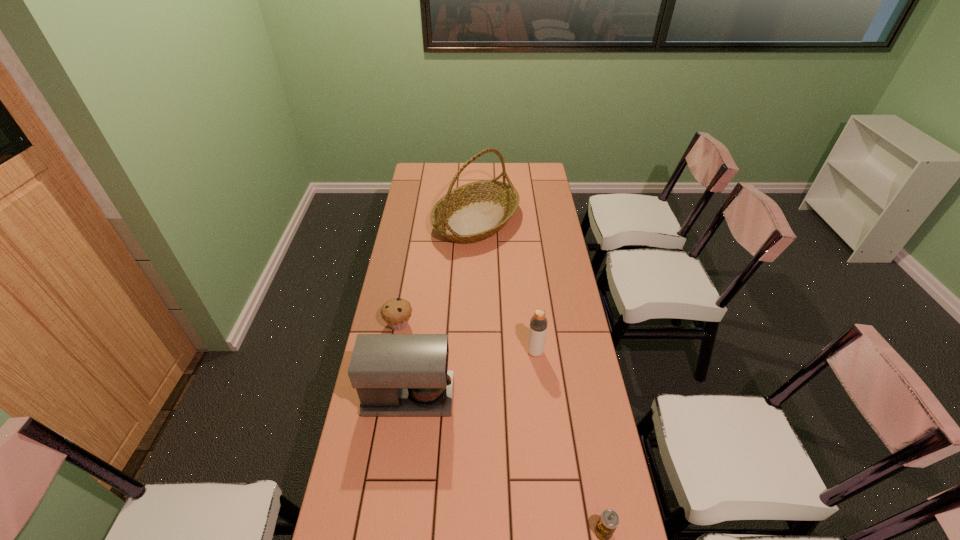
The height and width of the screenshot is (540, 960). What are the coordinates of `basket` in the screenshot? It's located at (475, 211).

In order to click on the farthest object in this screenshot , I will do `click(475, 211)`.

In order to click on the fourth farthest object in this screenshot , I will do `click(394, 374)`.

Image resolution: width=960 pixels, height=540 pixels. I want to click on the third nearest object, so click(x=538, y=323).

At what (x,y) coordinates should I click in order to perform the action: click on muffin. Please return your answer as a coordinate pair (x, y). The width and height of the screenshot is (960, 540). Looking at the image, I should click on (396, 312).

You are a GUI agent. You are given a task and a screenshot of the screen. Output one action in this format:
    pyautogui.click(x=<x>, y=<y>)
    Task: Click on the free location located 0.230m on the front of the farthest object
    Image resolution: width=960 pixels, height=540 pixels.
    Given the screenshot: What is the action you would take?
    pyautogui.click(x=475, y=288)

The height and width of the screenshot is (540, 960). In order to click on vacant space positioned 0.150m on the carafe side of the coffee maker in this screenshot , I will do `click(498, 397)`.

This screenshot has height=540, width=960. Find the location of `vacant space located on the back of the bottle`. vacant space located on the back of the bottle is located at coordinates pyautogui.click(x=532, y=325).

The image size is (960, 540). I want to click on blank space located 0.220m on the right of the second farthest object, so click(x=471, y=325).

The image size is (960, 540). I want to click on basket situated at the left edge, so click(x=475, y=211).